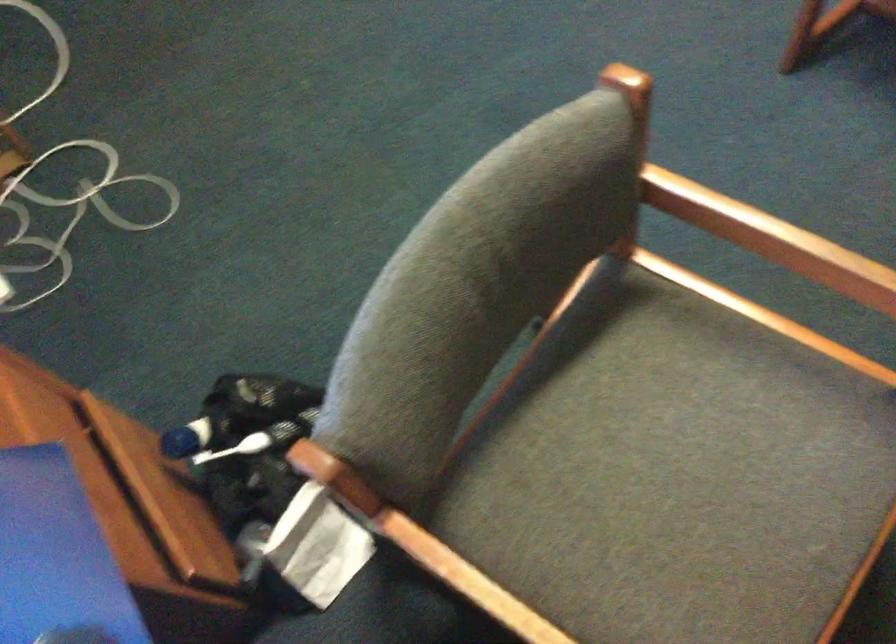
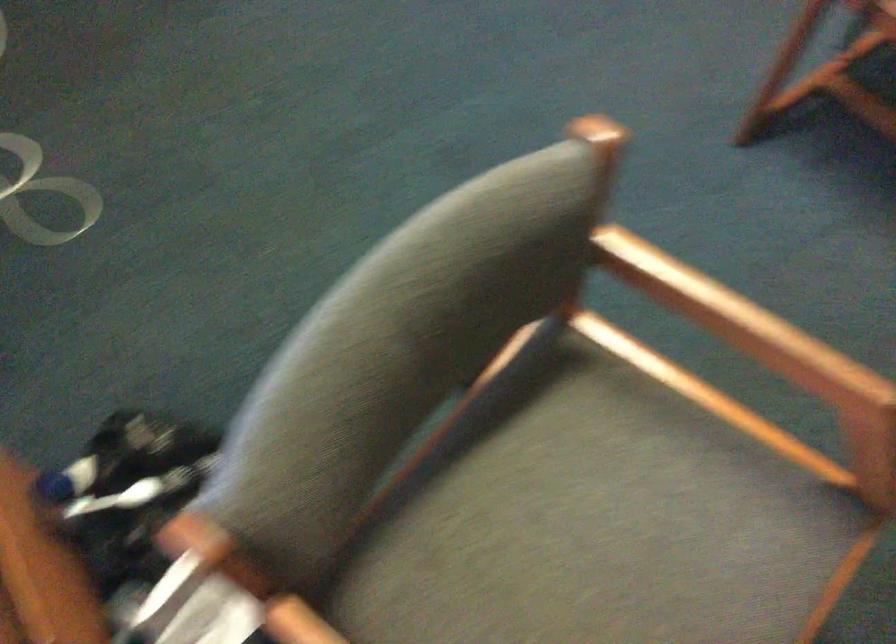
Question: Based on the continuous images, in which direction is the camera rotating? Reply with the corresponding letter.

Choices:
 (A) Left
 (B) Right
 (C) Up
 (D) Down

Answer: (B)